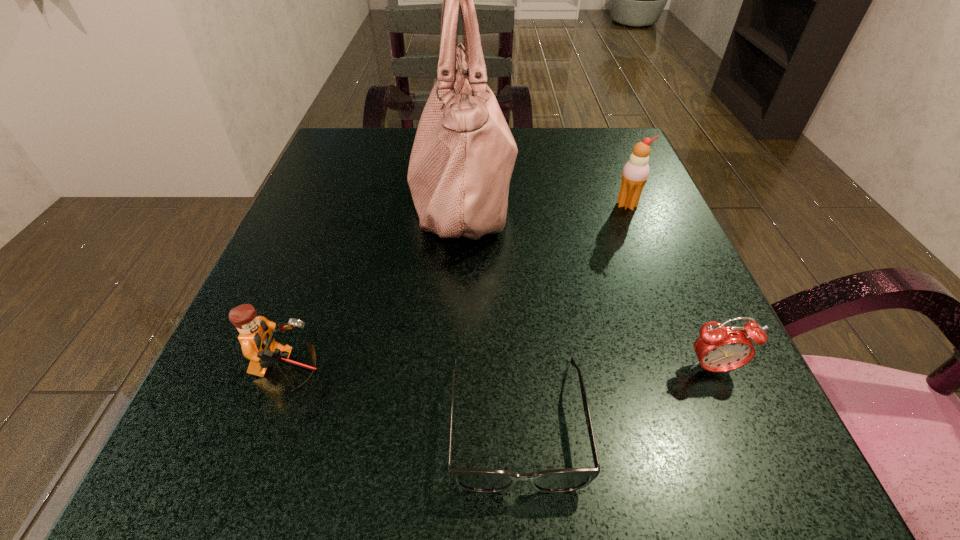
This screenshot has height=540, width=960. In order to click on object that is the closest to the shortest object in this screenshot , I will do `click(719, 348)`.

At what (x,y) coordinates should I click in order to perform the action: click on vacant space that satisfies the following two spatial constraints: 1. at the front with a straw on the second tallest object; 2. holding a crossbow in the hands of the leftmost object. Please return your answer as a coordinate pair (x, y). Looking at the image, I should click on (693, 372).

Locate an element on the screen. This screenshot has width=960, height=540. vacant area in the image that satisfies the following two spatial constraints: 1. at the front with a straw on the icecream; 2. holding a crossbow in the hands of the Lego is located at coordinates (693, 372).